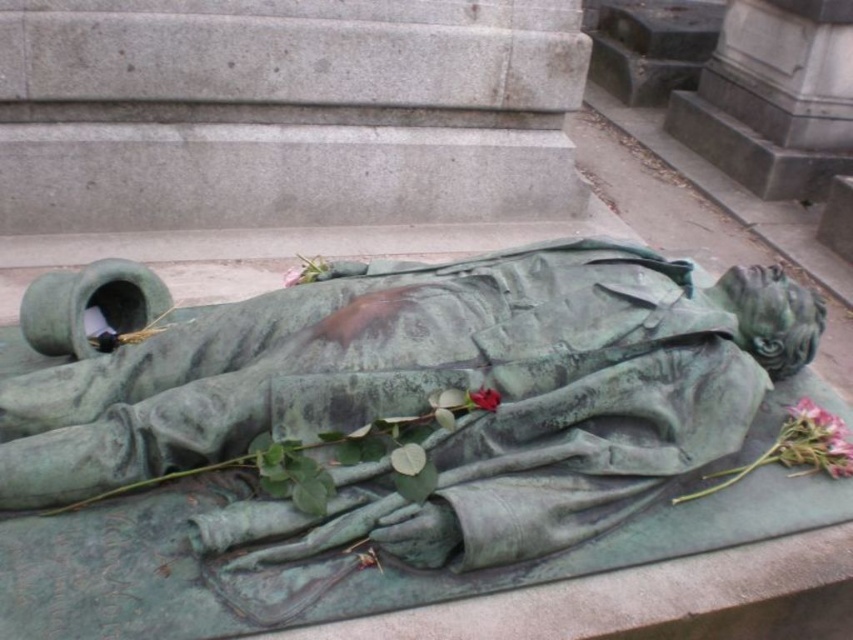
Does green patina statue at center appear under matte green rose at center?

Incorrect, green patina statue at center is not positioned below matte green rose at center.

How much distance is there between green patina statue at center and matte green rose at center?

green patina statue at center is 14.77 inches away from matte green rose at center.

At what (x,y) coordinates should I click in order to perform the action: click on green patina statue at center. Please return your answer as a coordinate pair (x, y). This screenshot has width=853, height=640. Looking at the image, I should click on (428, 397).

Is pink matte rose at lower right above matte green rose at center?

→ Incorrect, pink matte rose at lower right is not positioned above matte green rose at center.

Which of these two, pink matte rose at lower right or matte green rose at center, stands taller?

pink matte rose at lower right is taller.

Identify the location of pink matte rose at lower right. (815, 440).

Find the location of a particular element. pink matte rose at lower right is located at coordinates (815, 440).

Is point (432, 364) farther from camera compared to point (781, 461)?

No, (432, 364) is in front of (781, 461).

Identify the location of green patina statue at center. Image resolution: width=853 pixels, height=640 pixels. (428, 397).

Find the location of a particular element. The image size is (853, 640). green patina statue at center is located at coordinates (428, 397).